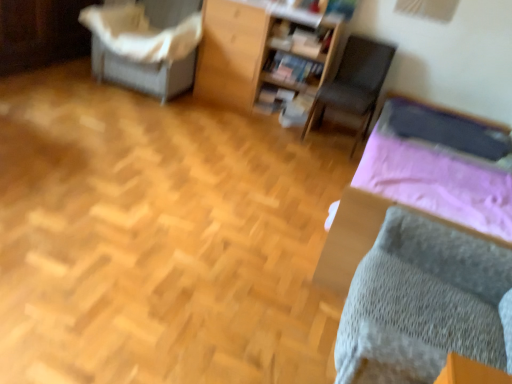
Find the location of a particular element. The width and height of the screenshot is (512, 384). vacant area located to the right-hand side of white fabric-covered chair at upper left, which is counted as the first furniture, starting from the left is located at coordinates (214, 112).